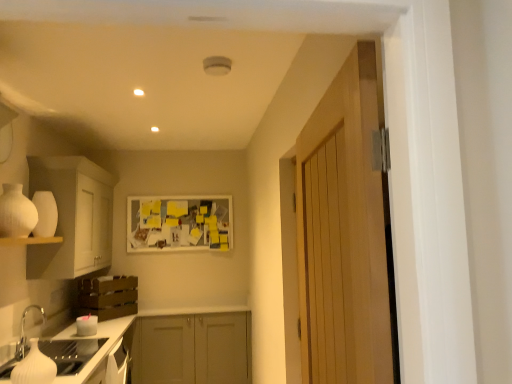
Where is `vacant space situated above matte gray cabinets at center, positioned as the third cabinetry in top-to-bottom order (from a real-world perspective)`? The height and width of the screenshot is (384, 512). vacant space situated above matte gray cabinets at center, positioned as the third cabinetry in top-to-bottom order (from a real-world perspective) is located at coordinates (196, 308).